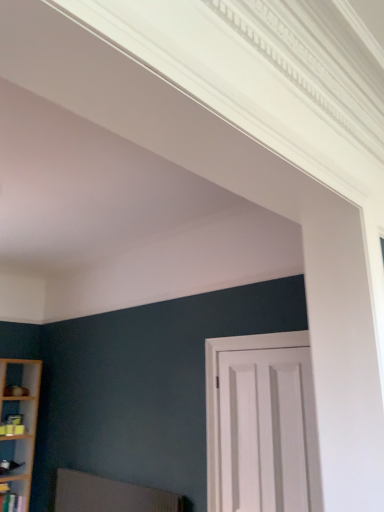
Identify the location of white matte door at center. (261, 424).

The height and width of the screenshot is (512, 384). Find the location of `textured fabric swivel chair at lower left`. textured fabric swivel chair at lower left is located at coordinates (109, 495).

Locate an element on the screen. The image size is (384, 512). white matte door at center is located at coordinates (261, 424).

Is there a large distance between textured fabric swivel chair at lower left and white matte door at center?

Yes, textured fabric swivel chair at lower left and white matte door at center are quite far apart.

From the picture: Can you confirm if textured fabric swivel chair at lower left is shorter than white matte door at center?

Yes, textured fabric swivel chair at lower left is shorter than white matte door at center.

In the image, is textured fabric swivel chair at lower left on the left side or the right side of white matte door at center?

Answer: Clearly, textured fabric swivel chair at lower left is on the left of white matte door at center in the image.

Can we say textured fabric swivel chair at lower left lies outside white matte door at center?

Yes.

Based on the photo, is wooden shelf at lower left surrounded by textured fabric swivel chair at lower left?

No, textured fabric swivel chair at lower left does not contain wooden shelf at lower left.

From the image's perspective, which one is positioned higher, textured fabric swivel chair at lower left or wooden shelf at lower left?

From the image's view, textured fabric swivel chair at lower left is above.

Is textured fabric swivel chair at lower left facing away from wooden shelf at lower left?

textured fabric swivel chair at lower left is not turned away from wooden shelf at lower left.

Choose the correct answer: Is wooden shelf at lower left inside textured fabric swivel chair at lower left or outside it?

wooden shelf at lower left is not inside textured fabric swivel chair at lower left, it's outside.

Is wooden shelf at lower left positioned behind textured fabric swivel chair at lower left?

Yes, wooden shelf at lower left is behind textured fabric swivel chair at lower left.

Considering the sizes of objects wooden shelf at lower left and textured fabric swivel chair at lower left in the image provided, who is thinner, wooden shelf at lower left or textured fabric swivel chair at lower left?

Thinner between the two is textured fabric swivel chair at lower left.

Considering the relative sizes of wooden shelf at lower left and textured fabric swivel chair at lower left in the image provided, is wooden shelf at lower left taller than textured fabric swivel chair at lower left?

No.

Looking at this image, does white matte door at center have a smaller size compared to textured fabric swivel chair at lower left?

Correct, white matte door at center occupies less space than textured fabric swivel chair at lower left.

Is white matte door at center touching textured fabric swivel chair at lower left?

No, white matte door at center is not beside textured fabric swivel chair at lower left.

Can you confirm if white matte door at center is thinner than textured fabric swivel chair at lower left?

Correct, the width of white matte door at center is less than that of textured fabric swivel chair at lower left.

What's the angular difference between white matte door at center and textured fabric swivel chair at lower left's facing directions?

The angular difference between white matte door at center and textured fabric swivel chair at lower left is 0.255 degrees.

Between wooden shelf at lower left and white matte door at center, which one appears on the left side from the viewer's perspective?

wooden shelf at lower left.

Is wooden shelf at lower left wider than white matte door at center?

Yes.

Is the position of wooden shelf at lower left less distant than that of white matte door at center?

No, it is not.

Is wooden shelf at lower left with white matte door at center?

No, wooden shelf at lower left is not with white matte door at center.

Is white matte door at center touching wooden shelf at lower left?

white matte door at center and wooden shelf at lower left are clearly separated.

Considering the relative sizes of white matte door at center and wooden shelf at lower left in the image provided, is white matte door at center taller than wooden shelf at lower left?

Indeed, white matte door at center has a greater height compared to wooden shelf at lower left.

How far apart are white matte door at center and wooden shelf at lower left?

white matte door at center is 3.49 meters from wooden shelf at lower left.

Would you say white matte door at center is outside wooden shelf at lower left?

white matte door at center is positioned outside wooden shelf at lower left.

Image resolution: width=384 pixels, height=512 pixels. I want to click on swivel chair that appears below the white matte door at center (from a real-world perspective), so click(x=109, y=495).

Find the location of `shelf that appears behind the textured fabric swivel chair at lower left`. shelf that appears behind the textured fabric swivel chair at lower left is located at coordinates (11, 500).

Considering their positions, is wooden shelf at lower left positioned further to white matte door at center than textured fabric swivel chair at lower left?

Among the two, wooden shelf at lower left is located further to white matte door at center.

Considering their positions, is wooden shelf at lower left positioned further to textured fabric swivel chair at lower left than white matte door at center?

wooden shelf at lower left lies further to textured fabric swivel chair at lower left than the other object.

From the picture: When comparing their distances from wooden shelf at lower left, does textured fabric swivel chair at lower left or white matte door at center seem closer?

Among the two, textured fabric swivel chair at lower left is located nearer to wooden shelf at lower left.

Based on their spatial positions, is white matte door at center or wooden shelf at lower left closer to textured fabric swivel chair at lower left?

Among the two, white matte door at center is located nearer to textured fabric swivel chair at lower left.

Looking at the image, which one is located further to wooden shelf at lower left, white matte door at center or textured fabric swivel chair at lower left?

Among the two, white matte door at center is located further to wooden shelf at lower left.

Considering their positions, is textured fabric swivel chair at lower left positioned closer to white matte door at center than wooden shelf at lower left?

Among the two, textured fabric swivel chair at lower left is located nearer to white matte door at center.

You are a GUI agent. You are given a task and a screenshot of the screen. Output one action in this format:
    pyautogui.click(x=<x>, y=<y>)
    Task: Click on the swivel chair between wooden shelf at lower left and white matte door at center in the horizontal direction
    
    Given the screenshot: What is the action you would take?
    pyautogui.click(x=109, y=495)